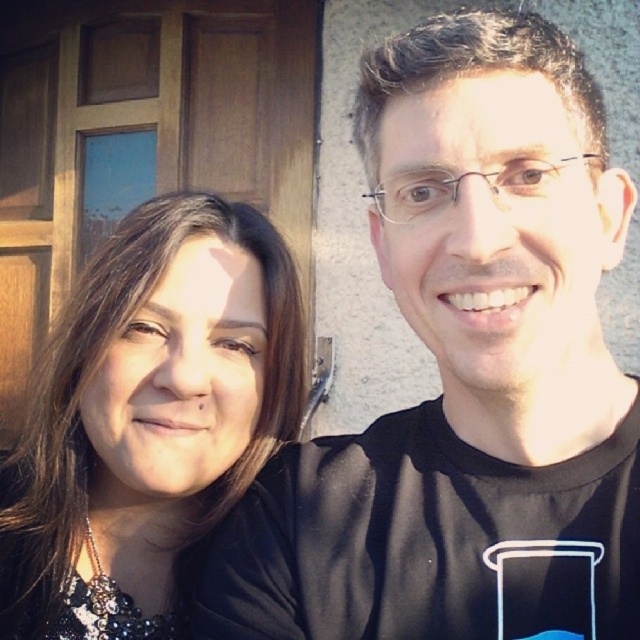
You are a photographer trying to frame two people for a portrait. The subjects are wearing a black matte shirt at right and a black fabric at left. If you want to ensure both shirts are visible in the frame, which subject should you position closer to the camera to maintain clarity?

The black matte shirt at right is wider than the black fabric at left, so positioning the subject in the black fabric at left closer to the camera would help maintain clarity as they are smaller in size.

You are a photographer trying to focus on the black matte shirt at right and the black fabric at left in the image. Which object is closer to the camera?

The black matte shirt at right is positioned under the black fabric at left, meaning it is closer to the camera since it appears below and in front of the other object.

You are taking a selfie with two friends. You notice a point at coordinates (465,372) in the image. Based on the scene description, what object does this point correspond to?

The point at coordinates (465,372) corresponds to the black matte shirt at right.